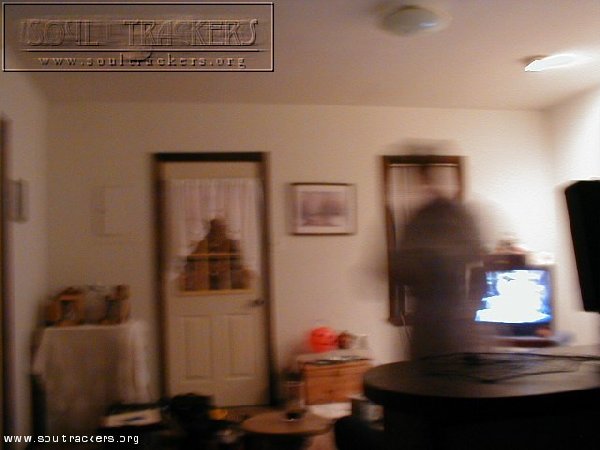
Where is `table`? The height and width of the screenshot is (450, 600). table is located at coordinates (408, 370), (532, 381).